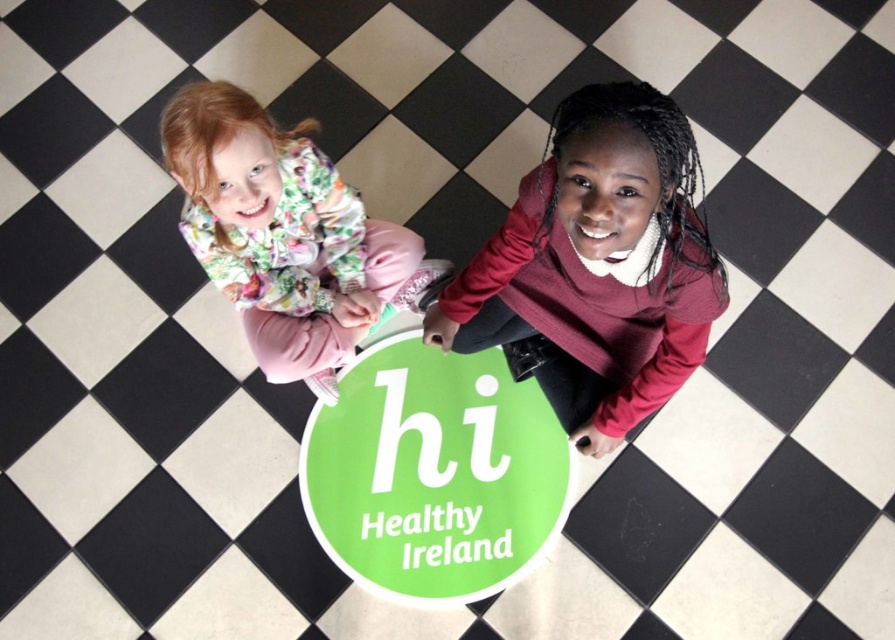
You are a photographer taking a picture of the maroon sweater at center and the floral fabric jacket at upper left. Based on their positions, which object is located more to the right?

The maroon sweater at center is located more to the right than the floral fabric jacket at upper left.

Looking at this image, you are a photographer trying to capture both the maroon sweater at center and the floral fabric jacket at upper left in a single shot. Given that your camera can only focus on objects wider than 30cm, which of these items might require you to adjust your camera settings to ensure proper focus?

The maroon sweater at center has a smaller width compared to the floral fabric jacket at upper left. Since the maroon sweater at center is narrower than 30cm, it might require adjusting the camera settings to ensure proper focus.